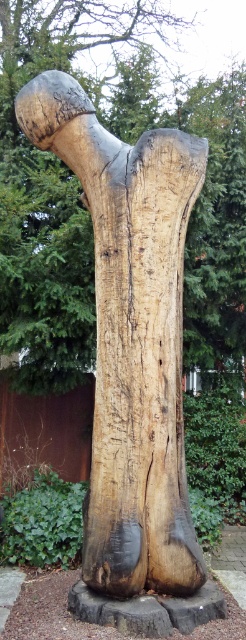
Consider the image. Is the position of natural wood sculpture at center more distant than that of natural wood tree trunk at center?

No, it is not.

Which is more to the right, natural wood sculpture at center or natural wood tree trunk at center?

natural wood sculpture at center

What do you see at coordinates (131, 337) in the screenshot?
I see `natural wood sculpture at center` at bounding box center [131, 337].

Identify the location of natural wood sculpture at center. The image size is (246, 640). (131, 337).